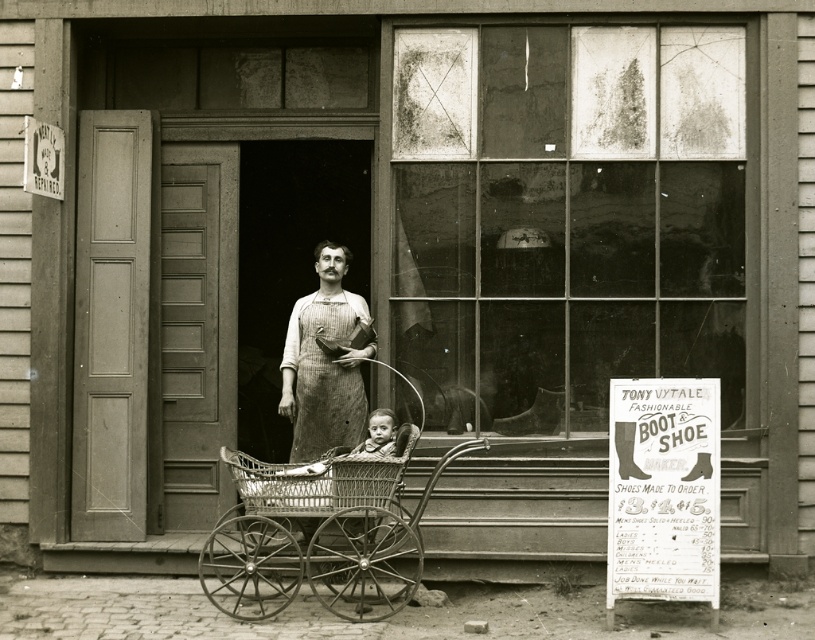
You are a photographer trying to capture the scene in this image. You want to ensure that both the wicker baby carriage at center and the rustic linen apron at center are clearly visible in your photo. Given their sizes, which object should you focus on first to ensure proper framing?

The wicker baby carriage at center is larger than the rustic linen apron at center, so you should focus on framing the wicker baby carriage at center first to ensure it occupies the appropriate space in the photo.

You are a delivery person who needs to place a small package between the wicker baby carriage at center and the rustic linen apron at center. Can you fit it there?

The distance between the wicker baby carriage at center and the rustic linen apron at center is 28.28 inches, so the small package can be placed there as there is enough space.

You are a photographer who wants to take a picture of the wicker baby carriage at center. You have a camera that can focus up to 25 feet. Can you take the picture without moving closer?

The wicker baby carriage at center and camera are 25.58 feet apart, which is beyond the camera focus range of 25 feet. Therefore, you cannot take the picture without moving closer.